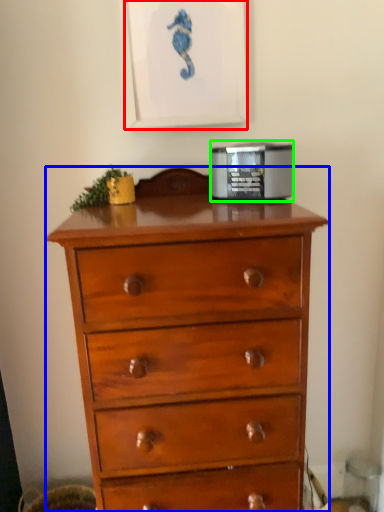
Question: Which object is positioned farthest from picture frame (highlighted by a red box)? Select from chest of drawers (highlighted by a blue box) and appliance (highlighted by a green box).

Choices:
 (A) chest of drawers
 (B) appliance

Answer: (A)